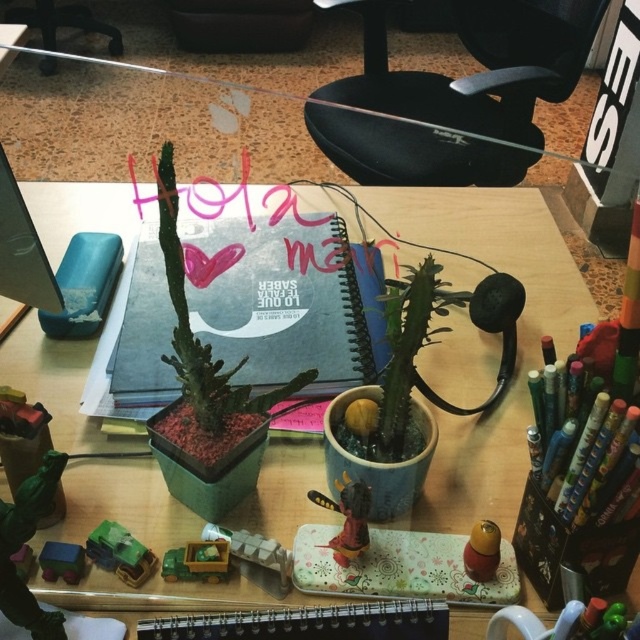
In the scene shown: You are organizing your desk and want to place a blue matte notebook at center and a shiny plastic bee at center. If your desk is 12 inches wide, can both items fit side by side without overlapping?

The blue matte notebook at center is 11.25 inches from the shiny plastic bee at center. Since the desk is 12 inches wide, both items can fit side by side with a small amount of space remaining between them.

You need to place both the blue matte notebook at center and the shiny plastic bee at center on a shelf that can only hold items up to 10 cm in width. Given their widths, can both items fit side by side on the shelf?

The blue matte notebook at center is wider than the shiny plastic bee at center. However, without knowing their exact widths, we cannot determine if their combined width exceeds 10 cm. More information is needed.

You have a small toy car that is 3 centimeters wide. You want to place it on the desk between the blue rubber at upper left and the matte blue toy truck at lower left. Can the toy car fit in the space between them?

The blue rubber at upper left is wider than the matte blue toy truck at lower left. Since the toy car is 3 centimeters wide, it can fit between them as the space between the two objects is likely wider than 3 centimeters.